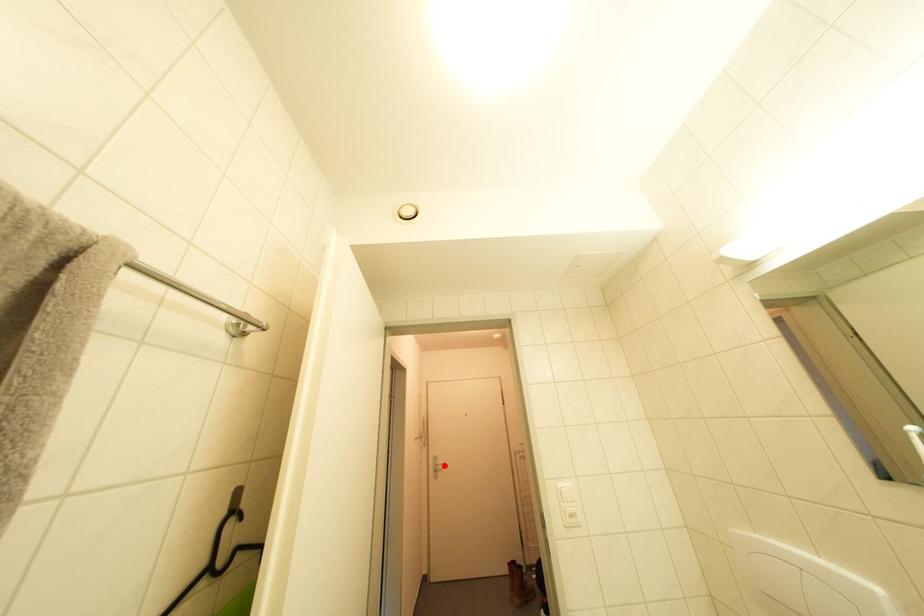
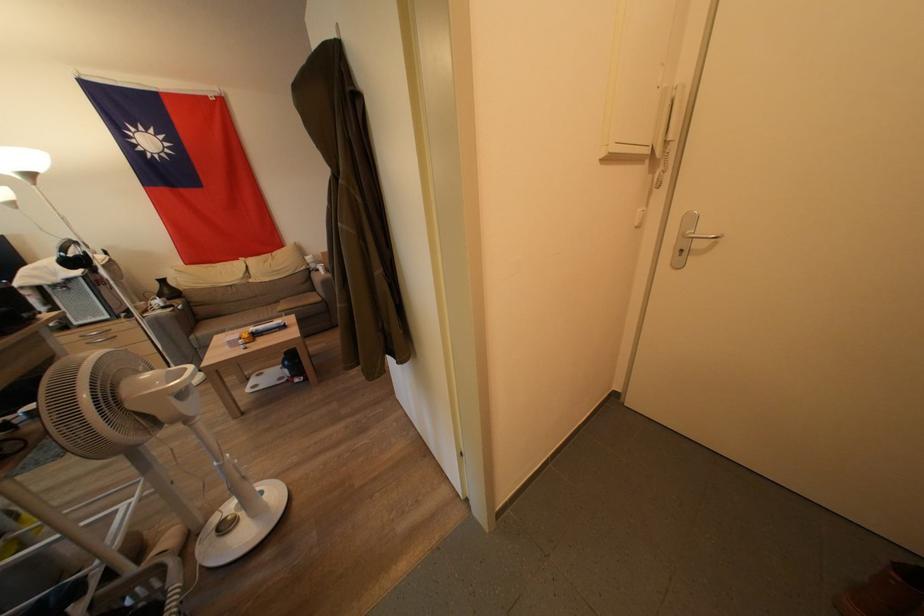
In the second image, find the point that corresponds to the highlighted location in the first image.

(710, 233)